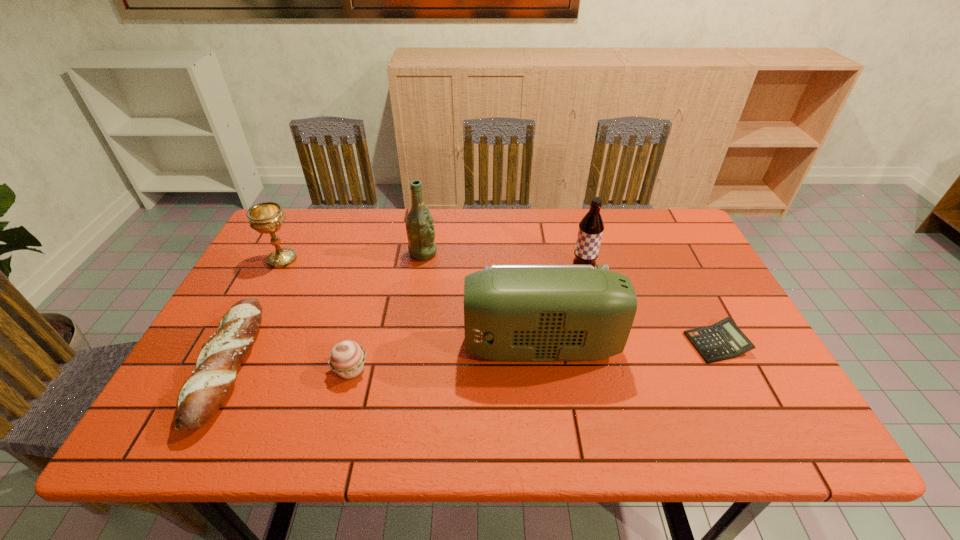
Image resolution: width=960 pixels, height=540 pixels. Find the location of `object that is at the near edge`. object that is at the near edge is located at coordinates (200, 397).

Find the location of a particular element. This screenshot has height=540, width=960. chalice located in the left edge section of the desktop is located at coordinates (267, 217).

Locate an element on the screen. The width and height of the screenshot is (960, 540). baguet present at the left edge is located at coordinates (200, 397).

The width and height of the screenshot is (960, 540). I want to click on object at the right edge, so click(x=723, y=340).

Identify the location of object present at the far left corner. (267, 217).

Where is `object located in the near left corner section of the desktop`? Image resolution: width=960 pixels, height=540 pixels. object located in the near left corner section of the desktop is located at coordinates (200, 397).

Identify the location of vacant area at the far edge of the desktop. This screenshot has height=540, width=960. (364, 241).

This screenshot has width=960, height=540. Identify the location of free space at the near edge of the desktop. (247, 417).

I want to click on vacant space at the left edge of the desktop, so click(x=264, y=338).

The image size is (960, 540). Identify the location of free region at the right edge. (671, 275).